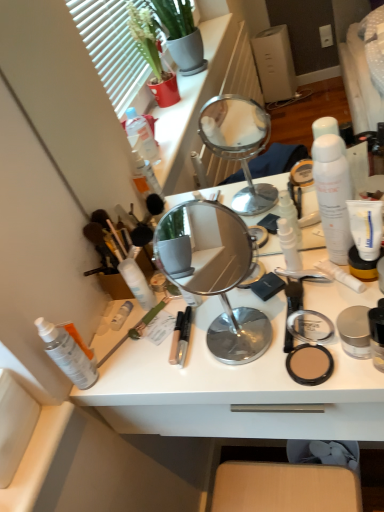
Locate an element on the screen. The height and width of the screenshot is (512, 384). vacant area that lies between transparent plastic spray bottle at lower left, the 6th toiletry viewed from the right, and white matte spray can at upper right, acting as the first toiletry starting from the right is located at coordinates (212, 322).